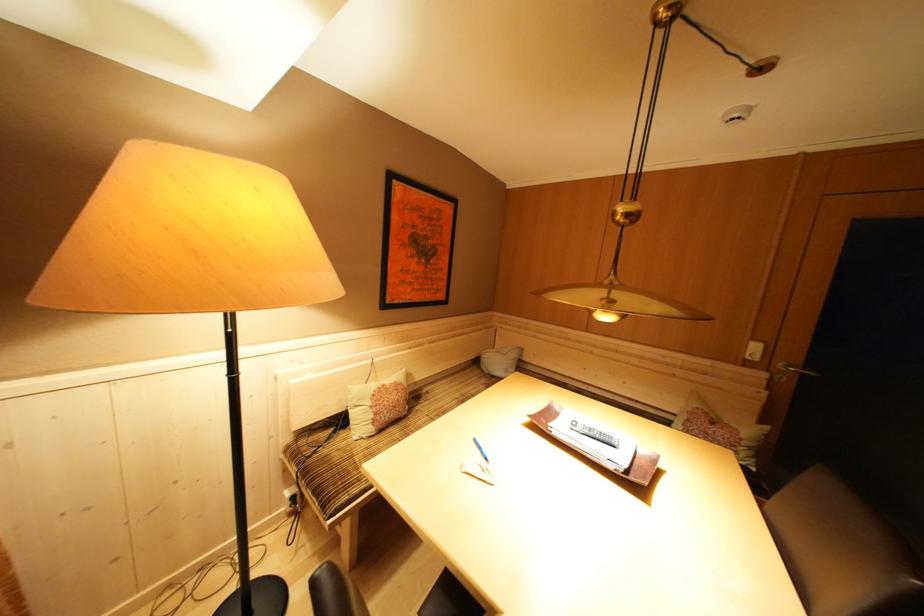
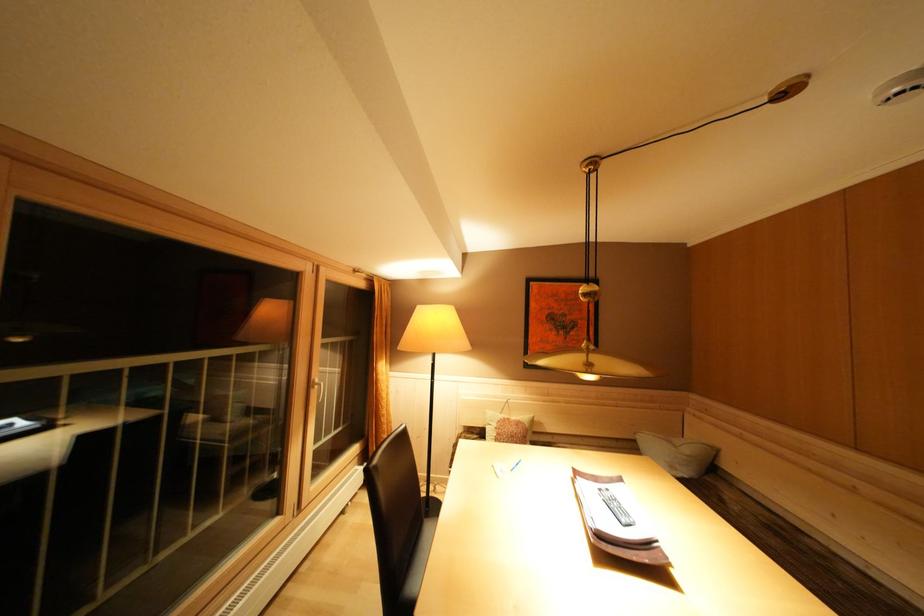
Where in the second image is the point corresponding to the point at 390,391 from the first image?

(515, 424)